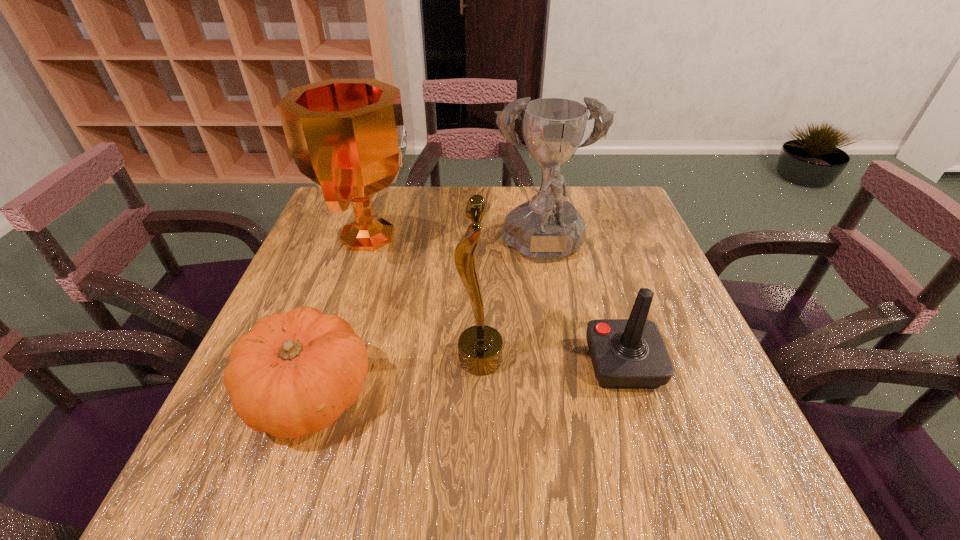
In the image, there is a desktop. Identify the location of vacant region at the right edge. (696, 342).

You are a GUI agent. You are given a task and a screenshot of the screen. Output one action in this format:
    pyautogui.click(x=<x>, y=<y>)
    Task: Click on the free space at the far left corner of the desktop
    
    Given the screenshot: What is the action you would take?
    pyautogui.click(x=375, y=214)

Identify the location of free space at the near left corner of the desktop. pyautogui.click(x=215, y=483).

In the image, there is a desktop. In order to click on vacant space at the far right corner in this screenshot , I will do `click(603, 197)`.

You are a GUI agent. You are given a task and a screenshot of the screen. Output one action in this format:
    pyautogui.click(x=<x>, y=<y>)
    Task: Click on the free spot between the nearest award and the pumpkin
    The width and height of the screenshot is (960, 540).
    Given the screenshot: What is the action you would take?
    pyautogui.click(x=396, y=377)

The height and width of the screenshot is (540, 960). What are the coordinates of `free space that is in between the nearest award and the joystick` in the screenshot? It's located at (552, 362).

Locate an element on the screen. free space between the shortest object and the second shortest object is located at coordinates (467, 380).

I want to click on empty space that is in between the leftmost award and the second shortest object, so click(x=496, y=300).

Image resolution: width=960 pixels, height=540 pixels. In order to click on vacant area between the shortest object and the nearest award in this screenshot , I will do `click(396, 377)`.

You are a GUI agent. You are given a task and a screenshot of the screen. Output one action in this format:
    pyautogui.click(x=<x>, y=<y>)
    Task: Click on the vacant area that lies between the pumpkin and the nearest award
    
    Given the screenshot: What is the action you would take?
    pyautogui.click(x=396, y=377)